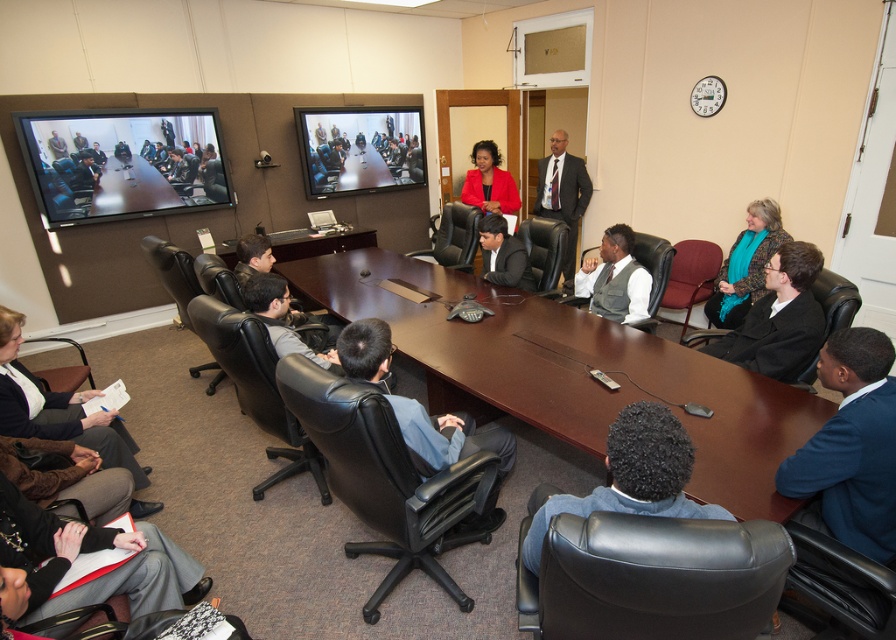
Is the position of gray fabric pants at lower left more distant than that of matte black conference table at center?

No, gray fabric pants at lower left is in front of matte black conference table at center.

Can you confirm if gray fabric pants at lower left is positioned below matte black conference table at center?

Yes.

Is point (26, 540) closer to viewer compared to point (108, 180)?

Yes.

The image size is (896, 640). Identify the location of gray fabric pants at lower left. (82, 557).

How much distance is there between brown wooden table at center and matte black conference table at center?

brown wooden table at center is 7.46 feet from matte black conference table at center.

What do you see at coordinates (573, 372) in the screenshot? I see `brown wooden table at center` at bounding box center [573, 372].

Locate an element on the screen. brown wooden table at center is located at coordinates click(x=573, y=372).

Who is positioned more to the left, blue sweater at lower right or matte red blazer at center?

matte red blazer at center

From the picture: Who is positioned more to the right, blue sweater at lower right or matte red blazer at center?

blue sweater at lower right is more to the right.

Between point (850, 474) and point (503, 211), which one is positioned behind?

Positioned behind is point (503, 211).

The width and height of the screenshot is (896, 640). I want to click on blue sweater at lower right, so click(x=851, y=448).